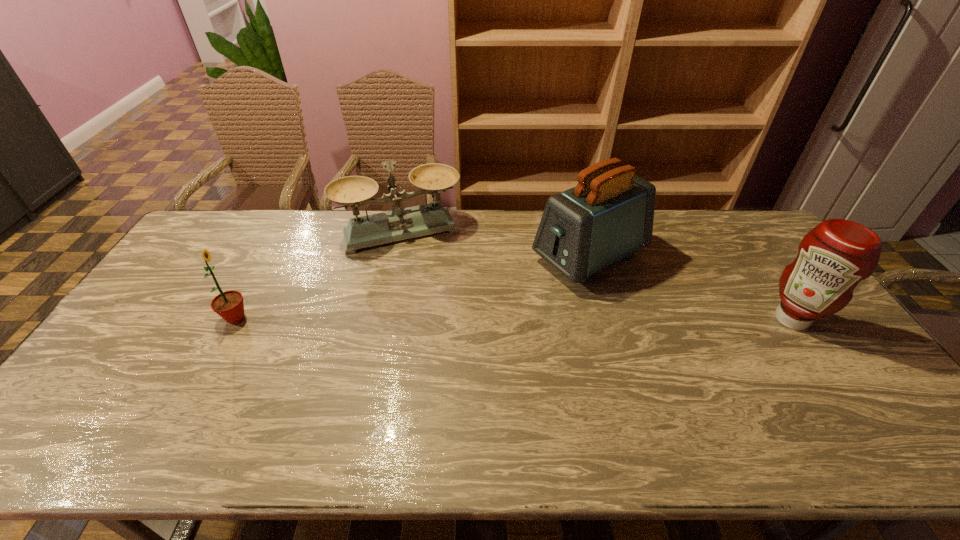
What are the coordinates of `object that ranks as the closest to the condiment` in the screenshot? It's located at (608, 216).